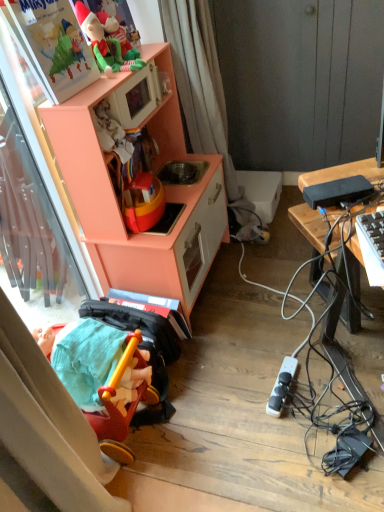
This screenshot has height=512, width=384. I want to click on blank space to the left of black plastic power strip at lower right, acting as the 2th appliance starting from the top, so click(232, 393).